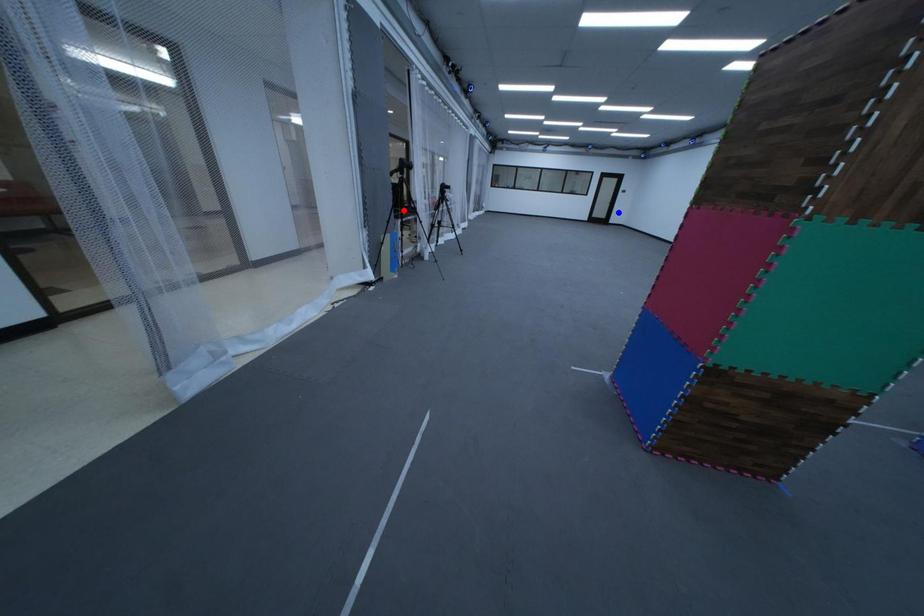
Question: In the image, two points are highlighted. Which point is nearer to the camera? Reply with the corresponding letter.

Choices:
 (A) blue point
 (B) red point

Answer: (B)